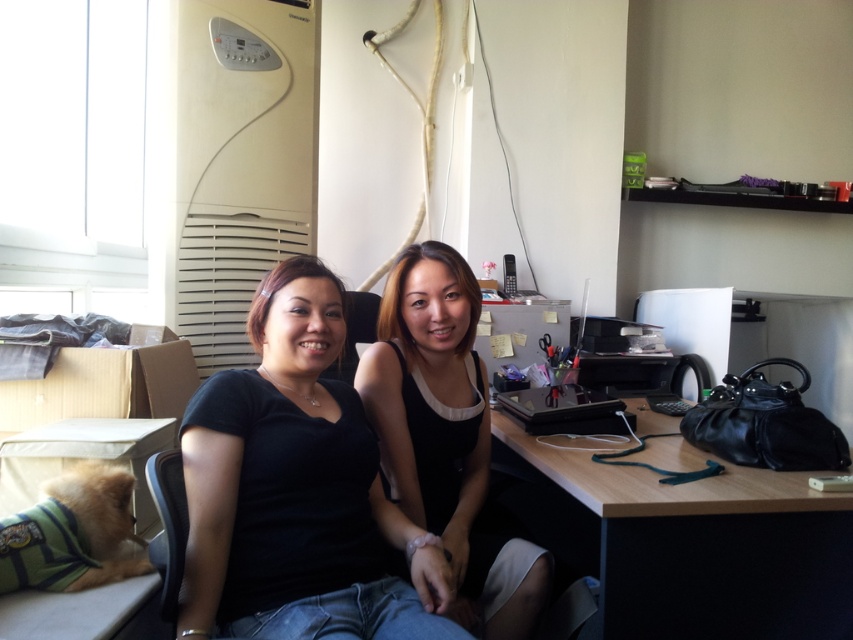
You are trying to decide where to place a new decorative item on the desk. The black matte shirt at center and the wooden desk at right are both in view. Which object is smaller and thus might be easier to work around?

The black matte shirt at center is smaller than the wooden desk at right, so it would be easier to work around when placing the decorative item.

You are organizing a closet and need to place the black matte shirt at center and the black matte dress at center on a shelf. Given that the shelf has limited vertical space, which item should you place first to ensure both fit without overlapping?

The black matte shirt at center should be placed first since it is located above the black matte dress at center, meaning it requires less vertical space below it to accommodate the dress.

You are a photographer taking a picture of the scene. You notice the black matte shirt at center and the wooden desk at right. Which object should you focus on first if you want to capture both in sharp focus?

The wooden desk at right should be focused on first because the black matte shirt at center is above it, meaning the desk is closer to the camera. Focusing on the closer object ensures both are in sharp focus.